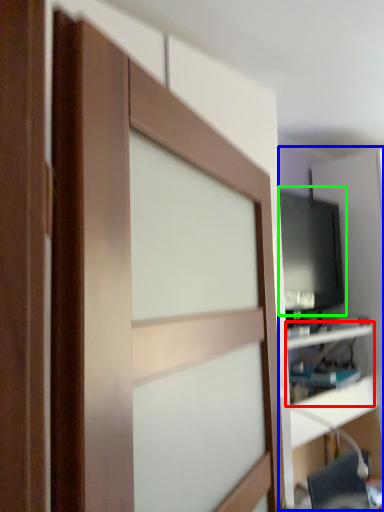
Question: Which object is the farthest from shelf (highlighted by a red box)? Choose among these: entertainment center (highlighted by a blue box) or computer monitor (highlighted by a green box).

Choices:
 (A) entertainment center
 (B) computer monitor

Answer: (A)